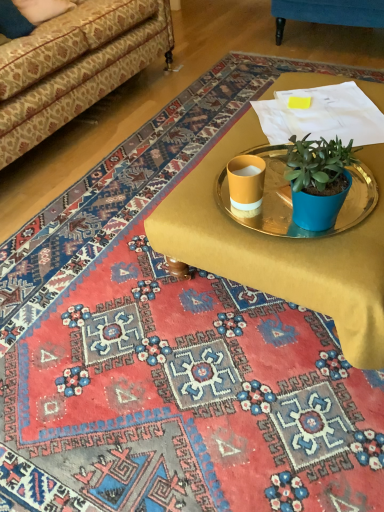
Where is `vacant space in front of matte yellow cup at center`? vacant space in front of matte yellow cup at center is located at coordinates (255, 241).